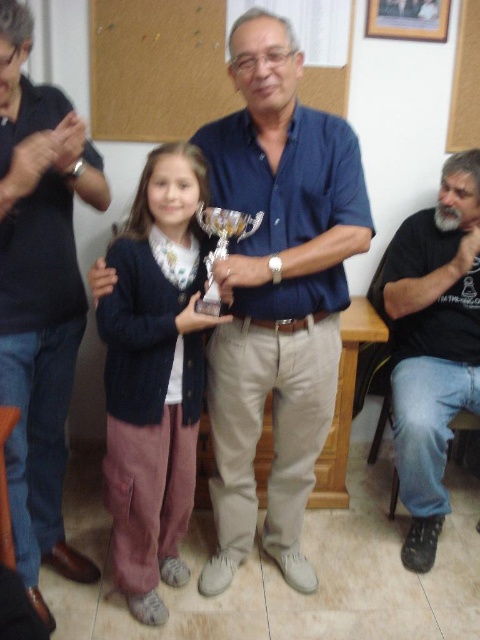
Which is more to the left, knitted sweater at center or wooden frame at upper center?

From the viewer's perspective, knitted sweater at center appears more on the left side.

Measure the distance from knitted sweater at center to wooden frame at upper center.

knitted sweater at center and wooden frame at upper center are 5.15 feet apart from each other.

The width and height of the screenshot is (480, 640). In order to click on knitted sweater at center in this screenshot , I will do `click(154, 372)`.

How distant is knitted sweater at center from brushed metal trophy at center?

They are 11.48 inches apart.

Which is more to the right, knitted sweater at center or brushed metal trophy at center?

From the viewer's perspective, knitted sweater at center appears more on the right side.

The height and width of the screenshot is (640, 480). Find the location of `knitted sweater at center`. knitted sweater at center is located at coordinates (154, 372).

At what (x,y) coordinates should I click in order to perform the action: click on knitted sweater at center. Please return your answer as a coordinate pair (x, y). This screenshot has width=480, height=640. Looking at the image, I should click on point(154,372).

Is blue cotton shirt at center smaller than black cotton shirt at lower right?

Incorrect, blue cotton shirt at center is not smaller in size than black cotton shirt at lower right.

In the scene shown: Is blue cotton shirt at center to the right of black cotton shirt at lower right from the viewer's perspective?

Incorrect, blue cotton shirt at center is not on the right side of black cotton shirt at lower right.

Which is in front, point (252, 330) or point (440, 413)?

Point (252, 330) is more forward.

At what (x,y) coordinates should I click in order to perform the action: click on blue cotton shirt at center. Please return your answer as a coordinate pair (x, y). This screenshot has height=640, width=480. Looking at the image, I should click on (276, 292).